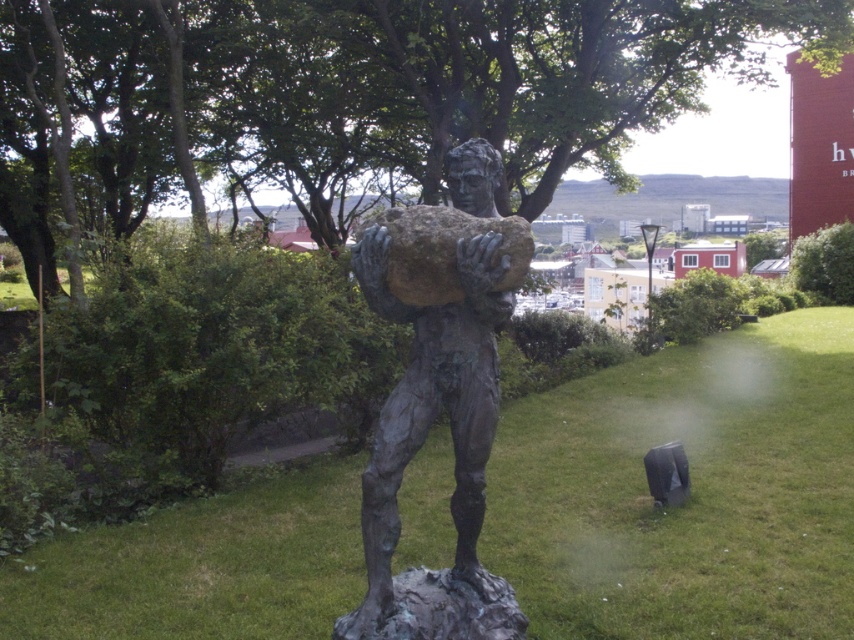
Which is behind, point (741, 628) or point (490, 362)?

Point (741, 628)

Which is more to the left, green grass at center or bronze statue at center?

From the viewer's perspective, bronze statue at center appears more on the left side.

Which is in front, point (507, 461) or point (434, 388)?

Point (434, 388) is in front.

This screenshot has width=854, height=640. Identify the location of green grass at center. (691, 490).